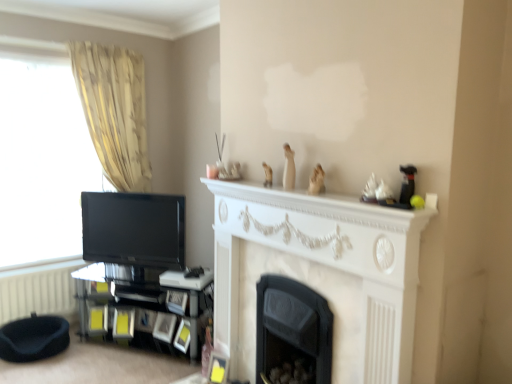
This screenshot has width=512, height=384. Identify the location of white marble fireplace at center. (324, 205).

The height and width of the screenshot is (384, 512). What do you see at coordinates (324, 205) in the screenshot? I see `white marble fireplace at center` at bounding box center [324, 205].

What do you see at coordinates (42, 163) in the screenshot? I see `matte black tv at left` at bounding box center [42, 163].

What do you see at coordinates (292, 326) in the screenshot? I see `black matte fireplace at center, placed as the 1th fireplace when sorted from back to front` at bounding box center [292, 326].

You are a GUI agent. You are given a task and a screenshot of the screen. Output one action in this format:
    pyautogui.click(x=<x>, y=<y>)
    Task: Click on the white marble fireplace at center, acting as the 2th fireplace starting from the back
    
    Given the screenshot: What is the action you would take?
    point(320,273)

What do you see at coordinates (33, 338) in the screenshot? This screenshot has width=512, height=384. I see `black fabric footrest at lower left` at bounding box center [33, 338].

Locate an element on the screen. The height and width of the screenshot is (384, 512). white textured radiator at lower left is located at coordinates (38, 290).

You are a GUI agent. You are given a task and a screenshot of the screen. Output one action in this format:
    pyautogui.click(x=<x>, y=<y>)
    Task: Click on the white marble fireplace at center
    This screenshot has height=384, width=512.
    Given the screenshot: What is the action you would take?
    pyautogui.click(x=324, y=205)

Which is in front, point (240, 187) or point (113, 137)?

The point (240, 187) is in front.

Is white marble fireplace at center to the left of beige fabric curtain at left from the viewer's perspective?

In fact, white marble fireplace at center is to the right of beige fabric curtain at left.

Is white marble fireplace at center inside the boundaries of beige fabric curtain at left, or outside?

white marble fireplace at center is spatially situated outside beige fabric curtain at left.

From a real-world perspective, is white marble fireplace at center positioned above or below beige fabric curtain at left?

In terms of real-world spatial position, white marble fireplace at center is below beige fabric curtain at left.

You are a GUI agent. You are given a task and a screenshot of the screen. Output one action in this format:
    pyautogui.click(x=<x>, y=<y>)
    Task: Click on the footrest located below the white marble fireplace at center (from the image's perspective)
    The width and height of the screenshot is (512, 384).
    Given the screenshot: What is the action you would take?
    pyautogui.click(x=33, y=338)

Does white marble fireplace at center have a lesser height compared to black fabric footrest at lower left?

Yes.

Which is more to the right, white marble fireplace at center or black fabric footrest at lower left?

Positioned to the right is white marble fireplace at center.

From a real-world perspective, does white marble fireplace at center stand above black fabric footrest at lower left?

Correct, in the physical world, white marble fireplace at center is higher than black fabric footrest at lower left.

Based on the photo, is matte black tv at left next to white marble fireplace at center?

There is a gap between matte black tv at left and white marble fireplace at center.

Between matte black tv at left and white marble fireplace at center, which one has less height?

white marble fireplace at center.

Could you tell me if matte black tv at left is turned towards white marble fireplace at center?

Yes, matte black tv at left is turned towards white marble fireplace at center.

What are the coordinates of `mantle lying on the right of matte black tv at left` in the screenshot? It's located at (324, 205).

From a real-world perspective, is white textured radiator at lower left on black matte fireplace at center, which is the 2th fireplace from front to back?

Incorrect, from a real-world perspective, white textured radiator at lower left is lower than black matte fireplace at center, which is the 2th fireplace from front to back.

From the image's perspective, is white textured radiator at lower left under black matte fireplace at center, placed as the 1th fireplace when sorted from back to front?

No.

Does white textured radiator at lower left have a smaller size compared to black matte fireplace at center, placed as the 1th fireplace when sorted from back to front?

Indeed, white textured radiator at lower left has a smaller size compared to black matte fireplace at center, placed as the 1th fireplace when sorted from back to front.

Would you consider white marble fireplace at center to be distant from black glass shelf at lower left?

Yes.

Considering the positions of objects white marble fireplace at center and black glass shelf at lower left in the image provided, who is behind, white marble fireplace at center or black glass shelf at lower left?

Positioned behind is black glass shelf at lower left.

Is white marble fireplace at center wider than black glass shelf at lower left?

Incorrect, the width of white marble fireplace at center does not surpass that of black glass shelf at lower left.

Is white marble fireplace at center facing towards black glass shelf at lower left?

No, white marble fireplace at center is not facing towards black glass shelf at lower left.

Is point (394, 291) positioned after point (30, 340)?

No, it is in front of (30, 340).

Based on the photo, which of these two, white marble fireplace at center, acting as the 2th fireplace starting from the back, or black fabric footrest at lower left, is bigger?

white marble fireplace at center, acting as the 2th fireplace starting from the back, is bigger.

Is white marble fireplace at center, acting as the 2th fireplace starting from the back, looking in the opposite direction of black fabric footrest at lower left?

No.

Based on their positions, is white marble fireplace at center, which is counted as the 1th fireplace, starting from the front, located to the left or right of black fabric footrest at lower left?

white marble fireplace at center, which is counted as the 1th fireplace, starting from the front, is to the right of black fabric footrest at lower left.

From a real-world perspective, relative to black matte fireplace at center, placed as the 1th fireplace when sorted from back to front, is white marble fireplace at center, which is counted as the 1th fireplace, starting from the front, vertically above or below?

white marble fireplace at center, which is counted as the 1th fireplace, starting from the front, is situated higher than black matte fireplace at center, placed as the 1th fireplace when sorted from back to front, in the real world.

Is white marble fireplace at center, which is counted as the 1th fireplace, starting from the front, inside or outside of black matte fireplace at center, placed as the 1th fireplace when sorted from back to front?

white marble fireplace at center, which is counted as the 1th fireplace, starting from the front, is not enclosed by black matte fireplace at center, placed as the 1th fireplace when sorted from back to front.

Is white marble fireplace at center, acting as the 2th fireplace starting from the back, facing away from black matte fireplace at center, which is the 2th fireplace from front to back?

Yes, white marble fireplace at center, acting as the 2th fireplace starting from the back, is facing away from black matte fireplace at center, which is the 2th fireplace from front to back.

Locate an element on the screen. Image resolution: width=512 pixels, height=384 pixels. mantle lying in front of the beige fabric curtain at left is located at coordinates (324, 205).

Where is `mantle above the black fabric footrest at lower left (from the image's perspective)`? This screenshot has width=512, height=384. mantle above the black fabric footrest at lower left (from the image's perspective) is located at coordinates (324, 205).

When comparing their distances from black glass shelf at lower left, does white marble fireplace at center or black glossy tv at left seem further?

white marble fireplace at center is positioned further to the anchor black glass shelf at lower left.

Considering their positions, is beige fabric curtain at left positioned closer to black matte fireplace at center, which is the 2th fireplace from front to back, than matte black tv at left?

beige fabric curtain at left lies closer to black matte fireplace at center, which is the 2th fireplace from front to back, than the other object.

Considering their positions, is white marble fireplace at center positioned further to beige fabric curtain at left than black fabric footrest at lower left?

Among the two, white marble fireplace at center is located further to beige fabric curtain at left.

From the image, which object appears to be nearer to white textured radiator at lower left, black matte fireplace at center, which is the 2th fireplace from front to back, or white marble fireplace at center?

Based on the image, white marble fireplace at center appears to be nearer to white textured radiator at lower left.

Estimate the real-world distances between objects in this image. Which object is closer to black fabric footrest at lower left, white marble fireplace at center, which is counted as the 1th fireplace, starting from the front, or black glass shelf at lower left?

Based on the image, black glass shelf at lower left appears to be nearer to black fabric footrest at lower left.

Looking at the image, which one is located further to matte black tv at left, beige fabric curtain at left or white textured radiator at lower left?

white textured radiator at lower left.

Estimate the real-world distances between objects in this image. Which object is closer to white marble fireplace at center, which is counted as the 1th fireplace, starting from the front, matte black tv at left or white marble fireplace at center?

Among the two, white marble fireplace at center is located nearer to white marble fireplace at center, which is counted as the 1th fireplace, starting from the front.

When comparing their distances from white marble fireplace at center, does white marble fireplace at center, acting as the 2th fireplace starting from the back, or white textured radiator at lower left seem further?

The object further to white marble fireplace at center is white textured radiator at lower left.

At what (x,y) coordinates should I click in order to perform the action: click on shelf located between white marble fireplace at center, which is counted as the 1th fireplace, starting from the front, and black glossy tv at left in the depth direction. Please return your answer as a coordinate pair (x, y). This screenshot has height=384, width=512. Looking at the image, I should click on (142, 307).

Where is `shelf between matte black tv at left and black matte fireplace at center, placed as the 1th fireplace when sorted from back to front, in the horizontal direction`? The image size is (512, 384). shelf between matte black tv at left and black matte fireplace at center, placed as the 1th fireplace when sorted from back to front, in the horizontal direction is located at coordinates click(142, 307).

Where is `fireplace located between white marble fireplace at center, acting as the 2th fireplace starting from the back, and black glass shelf at lower left in the depth direction`? fireplace located between white marble fireplace at center, acting as the 2th fireplace starting from the back, and black glass shelf at lower left in the depth direction is located at coordinates (292, 326).

Where is `mantle situated between black fabric footrest at lower left and white marble fireplace at center, which is counted as the 1th fireplace, starting from the front, from left to right`? This screenshot has width=512, height=384. mantle situated between black fabric footrest at lower left and white marble fireplace at center, which is counted as the 1th fireplace, starting from the front, from left to right is located at coordinates (324, 205).